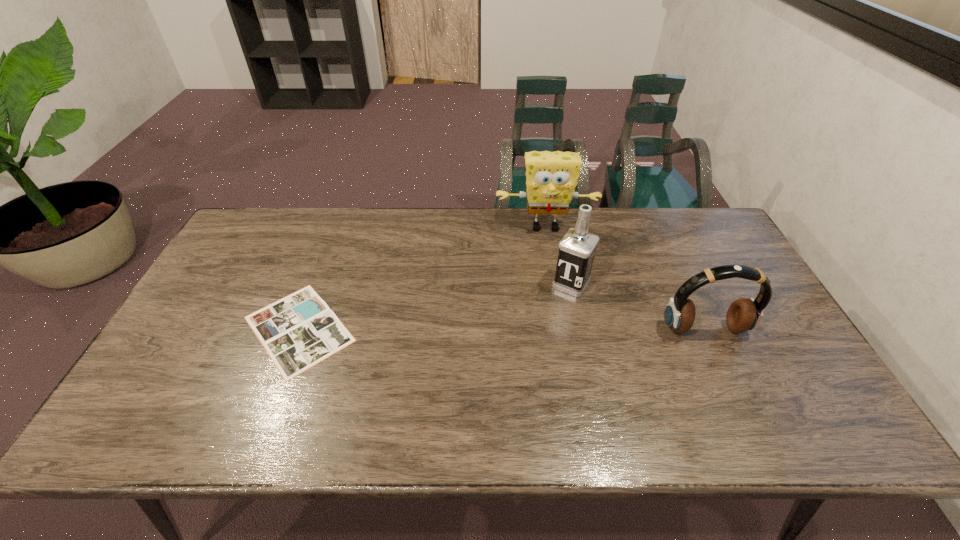
Find the location of `free space on the desktop that is between the shortest object and the rightmost object and is positioned on the face of the sponge`. free space on the desktop that is between the shortest object and the rightmost object and is positioned on the face of the sponge is located at coordinates (559, 329).

Find the location of a particular element. Image resolution: width=960 pixels, height=540 pixels. vacant space on the desktop that is between the book and the headset and is positioned on the front label of the vodka is located at coordinates (542, 329).